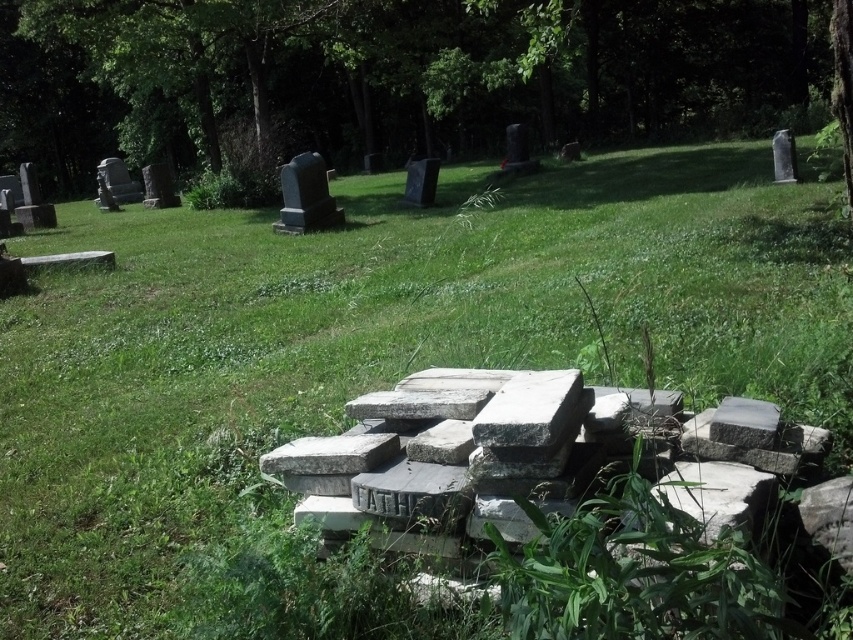
You are a groundskeeper in the cemetery and need to move the smooth gray stone at center to the smooth gray tombstone at upper left. If your wheelbarrow can carry items up to 7 meters, will you be able to transport it directly without needing to stop or adjust your path?

The distance between the smooth gray stone at center and the smooth gray tombstone at upper left is 6.50 meters. Since the wheelbarrow can carry items up to 7 meters, you can transport the smooth gray stone at center directly to the smooth gray tombstone at upper left without needing to stop or adjust your path.

You are standing in the cemetery and want to place a small flowerpot between the two points marked as point [424,184] and point [106,182]. Which point should the flowerpot be closer to in order to be nearer to the camera?

The flowerpot should be closer to point [424,184] because it is nearer to the camera compared to point [106,182].

You are a photographer standing at the camera position. You want to take a photo of the green leafy tree at upper center. Can you step forward to get closer to the tree without moving the camera? Explain why or why not.

The distance between the green leafy tree at upper center and the camera is 2.04 meters. Since you cannot move the camera, you cannot physically step forward to reduce this distance. The camera must remain in its current position to capture the scene as depicted.